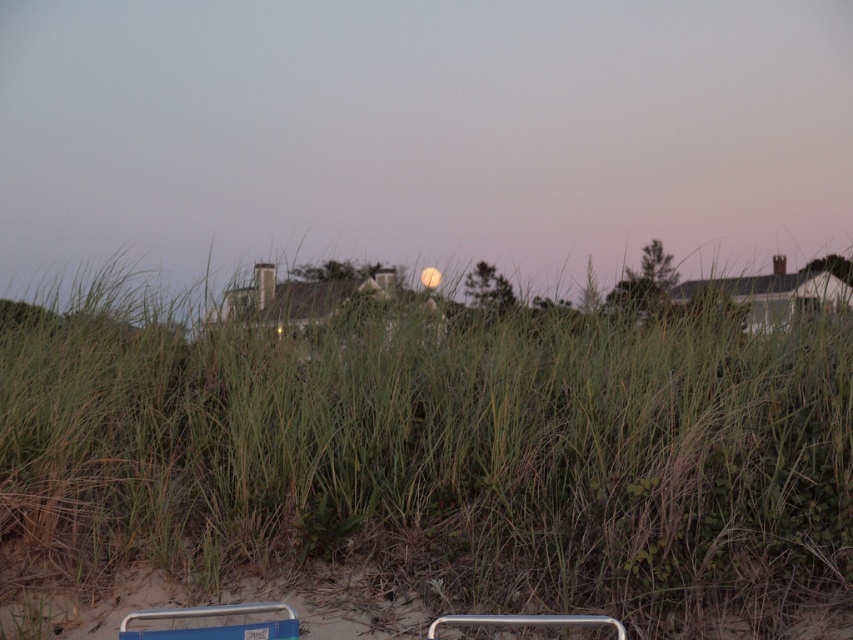
Question: Does green grass at center appear over metallic silver rail at lower center?

Choices:
 (A) yes
 (B) no

Answer: (A)

Question: Which point is farther to the camera?

Choices:
 (A) metallic silver rail at lower center
 (B) green grass at center

Answer: (B)

Question: Which point is farther to the camera?

Choices:
 (A) (480, 620)
 (B) (619, 403)

Answer: (B)

Question: Does green grass at center appear under metallic silver rail at lower center?

Choices:
 (A) yes
 (B) no

Answer: (B)

Question: Is green grass at center above metallic silver rail at lower center?

Choices:
 (A) yes
 (B) no

Answer: (A)